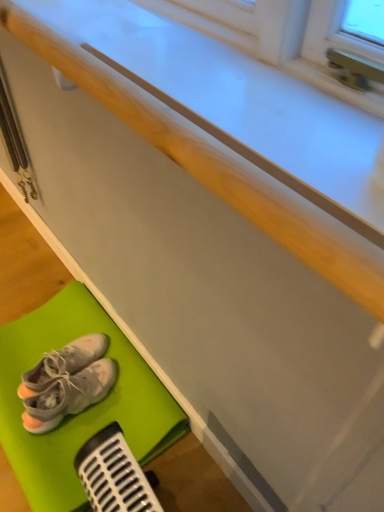
The height and width of the screenshot is (512, 384). Identify the location of free space that is to the left of white fabric sneakers at lower left, placed as the 2th footwear when sorted from bottom to top. (21, 358).